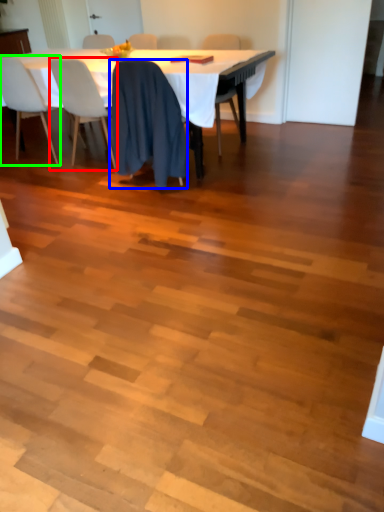
Question: Which is farther away from chair (highlighted by a red box)? chair (highlighted by a blue box) or chair (highlighted by a green box)?

Choices:
 (A) chair
 (B) chair

Answer: (A)